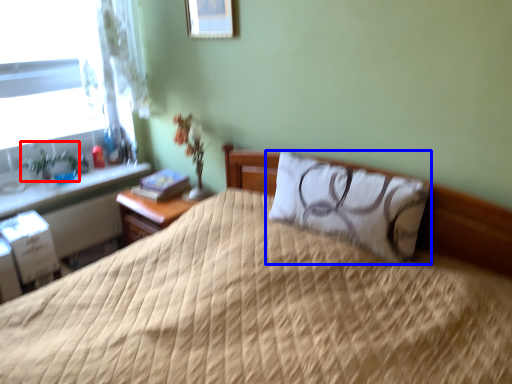
Question: Which of the following is the closest to the observer, plant (highlighted by a red box) or pillow (highlighted by a blue box)?

Choices:
 (A) plant
 (B) pillow

Answer: (B)